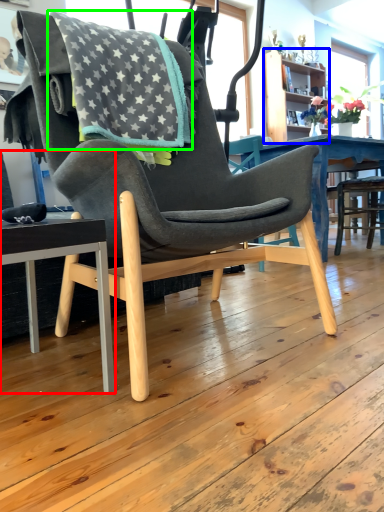
Question: Which is farther away from chair (highlighted by a red box)? bookshelf (highlighted by a blue box) or blanket (highlighted by a green box)?

Choices:
 (A) bookshelf
 (B) blanket

Answer: (A)